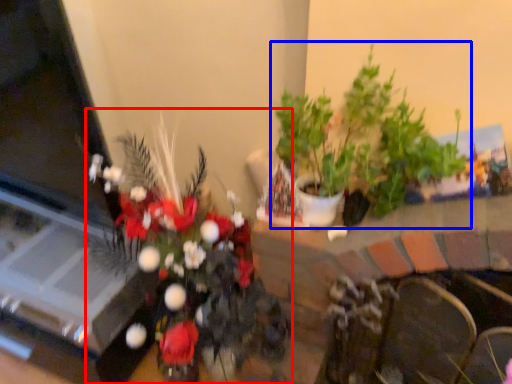
Question: Which point is further to the camera, houseplant (highlighted by a red box) or houseplant (highlighted by a blue box)?

Choices:
 (A) houseplant
 (B) houseplant

Answer: (B)